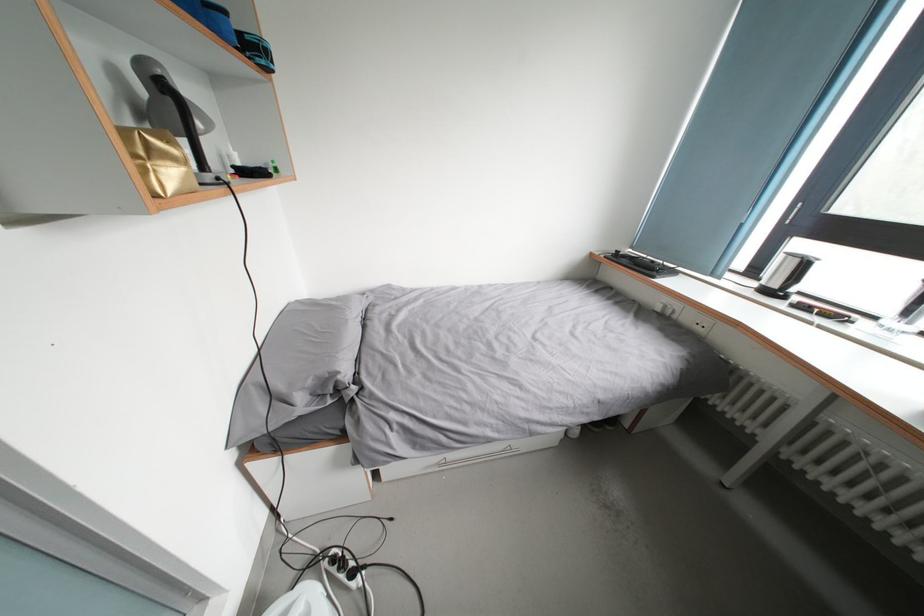
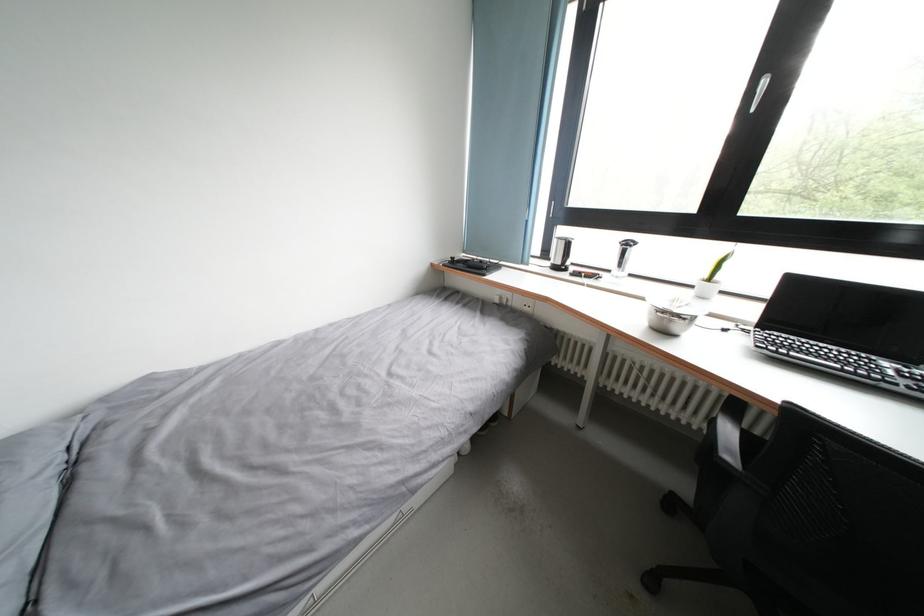
Find the pixel in the second image that matches point (694, 323) in the first image.

(524, 308)